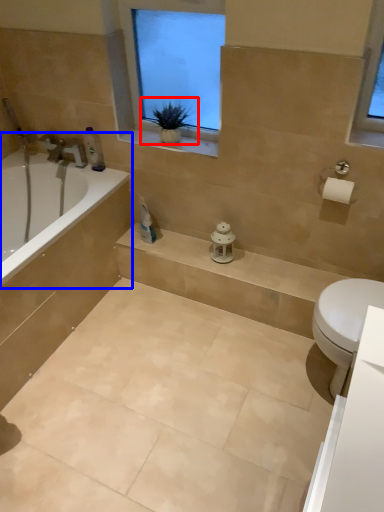
Question: Which object is further to the camera taking this photo, houseplant (highlighted by a red box) or bathtub (highlighted by a blue box)?

Choices:
 (A) houseplant
 (B) bathtub

Answer: (B)